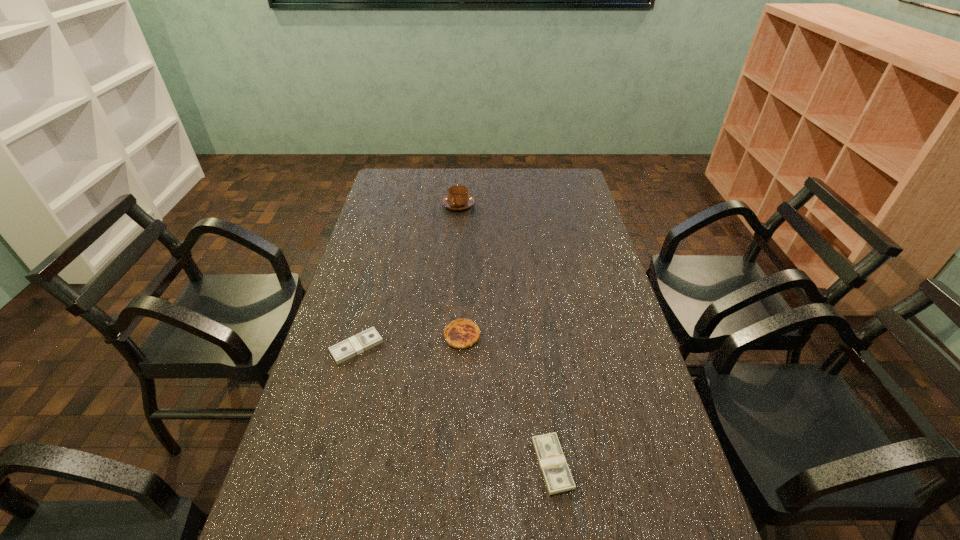
Locate an element on the screen. Image resolution: width=960 pixels, height=540 pixels. free region located 0.240m on the right of the nearest object is located at coordinates point(674,464).

This screenshot has height=540, width=960. In order to click on object positioned at the left edge in this screenshot , I will do `click(369, 338)`.

Locate an element on the screen. This screenshot has width=960, height=540. vacant space at the far edge of the desktop is located at coordinates (444, 181).

In the image, there is a desktop. At what (x,y) coordinates should I click in order to perform the action: click on vacant space at the left edge. Please return your answer as a coordinate pair (x, y). This screenshot has width=960, height=540. Looking at the image, I should click on (390, 242).

You are a GUI agent. You are given a task and a screenshot of the screen. Output one action in this format:
    pyautogui.click(x=<x>, y=<y>)
    Task: Click on the vacant space at the right edge of the desktop
    This screenshot has height=540, width=960.
    Given the screenshot: What is the action you would take?
    click(591, 354)

Where is `free space at the far right corner of the desktop`? This screenshot has height=540, width=960. free space at the far right corner of the desktop is located at coordinates (554, 194).

You are a GUI agent. You are given a task and a screenshot of the screen. Output one action in this format:
    pyautogui.click(x=<x>, y=<y>)
    Task: Click on the unoccupied area between the quiche and the cappuccino
    The height and width of the screenshot is (540, 960).
    Given the screenshot: What is the action you would take?
    pyautogui.click(x=461, y=271)

This screenshot has width=960, height=540. Identify the location of free area in between the quiche and the left dollar. (410, 341).

Image resolution: width=960 pixels, height=540 pixels. What are the coordinates of `vacant space in between the rightmost object and the farthest object` in the screenshot? It's located at (506, 334).

Locate an element on the screen. This screenshot has width=960, height=540. vacant space in between the farther dollar and the quiche is located at coordinates (410, 341).